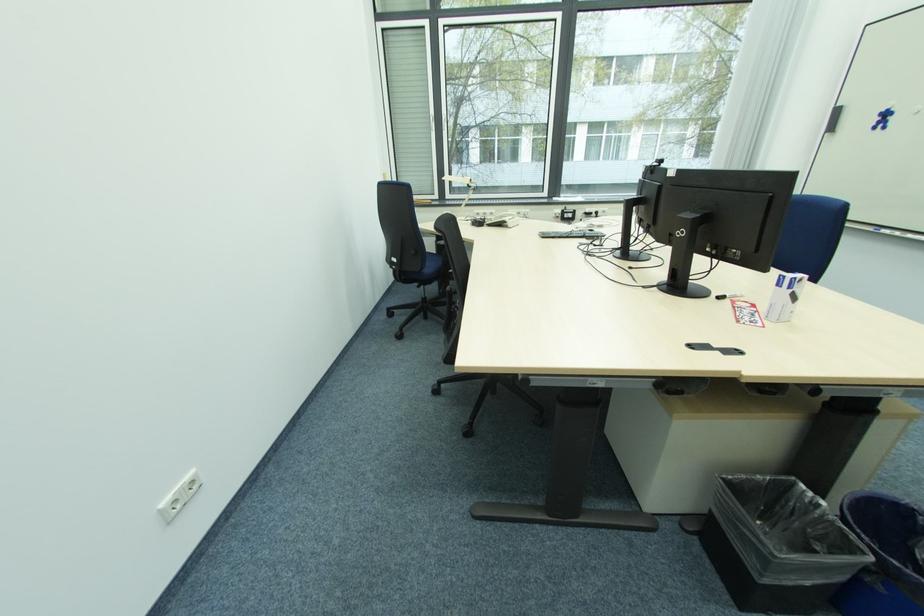
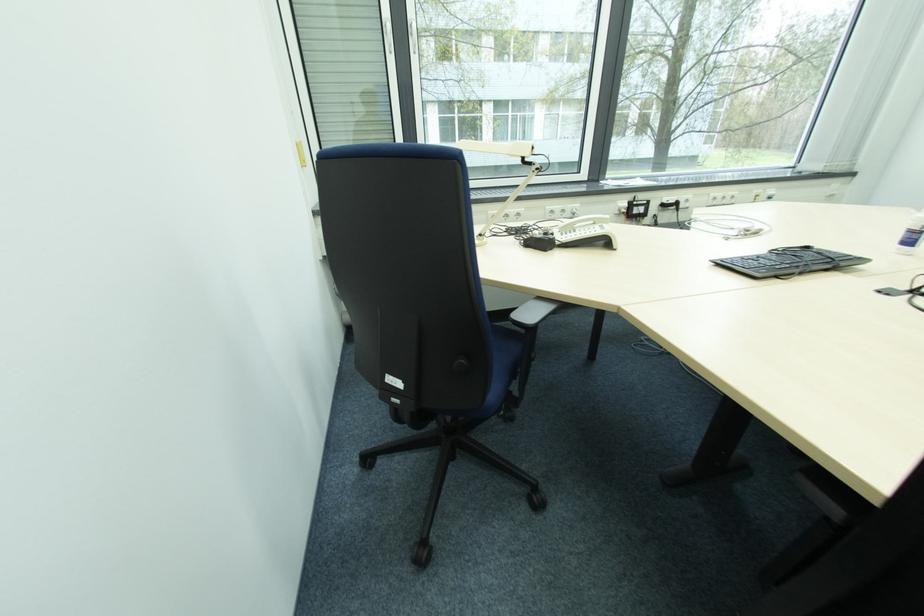
Question: What movement of the cameraman would produce the second image?

Choices:
 (A) Left
 (B) Right
 (C) Forward
 (D) Backward

Answer: (C)